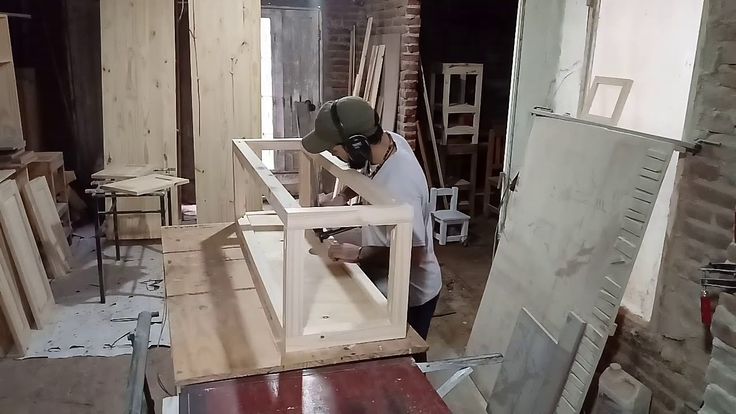
This screenshot has height=414, width=736. Identify the location of plastic jug. (623, 401).